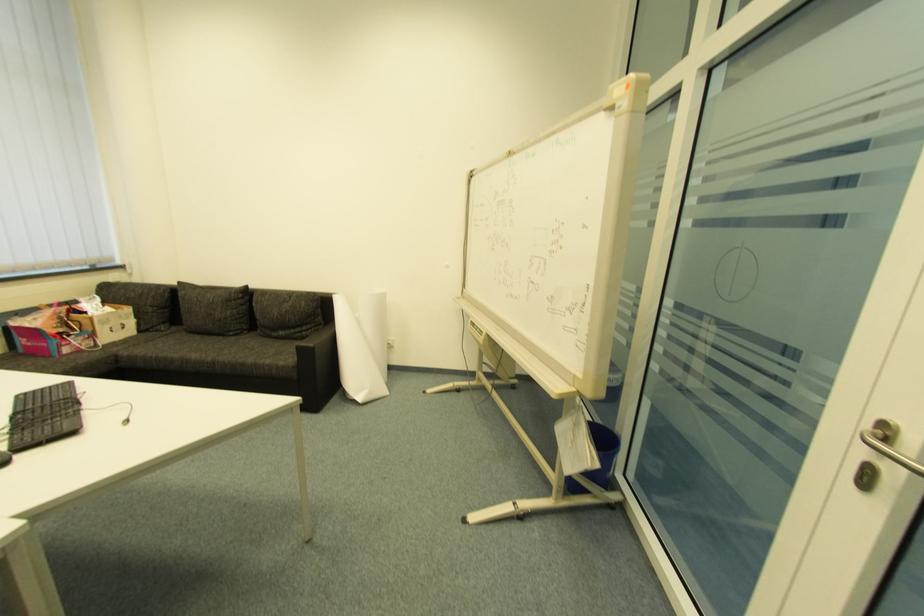
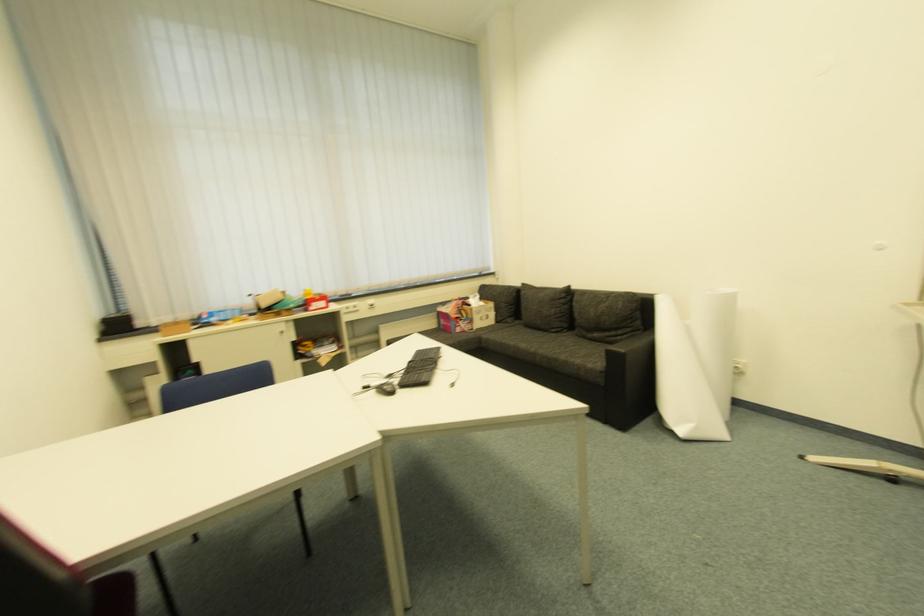
Question: The images are taken continuously from a first-person perspective. In which direction is your viewpoint rotating?

Choices:
 (A) Left
 (B) Right
 (C) Up
 (D) Down

Answer: (A)